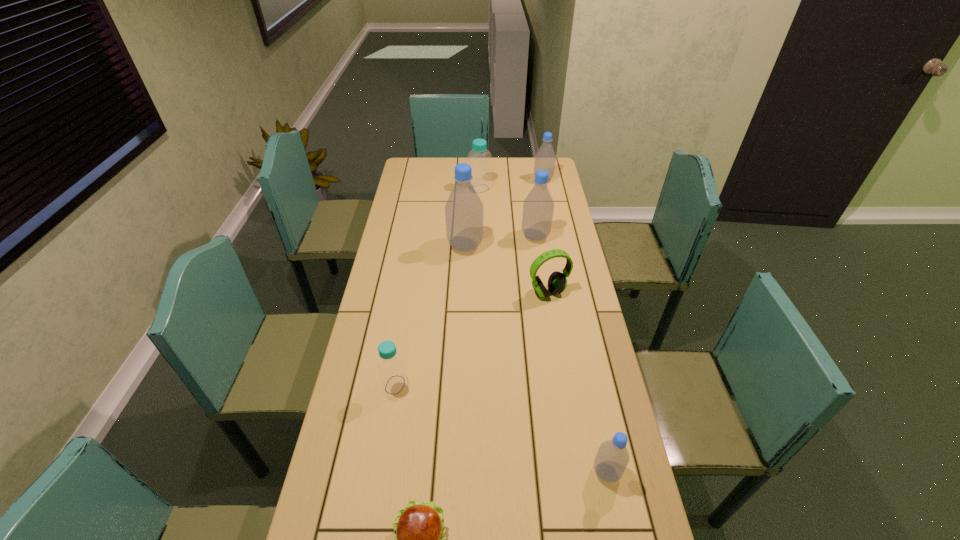
Identify the location of the leftmost gray bottle. (464, 211).

Locate an element on the screen. the tallest object is located at coordinates (464, 211).

Image resolution: width=960 pixels, height=540 pixels. Find the location of `the second tallest object`. the second tallest object is located at coordinates (538, 207).

Identify the location of the third smallest gray bottle. The image size is (960, 540). [x=538, y=207].

Identify the location of the right blue bottle. (479, 158).

Locate an element on the screen. This screenshot has width=960, height=540. the farther blue bottle is located at coordinates (479, 158).

Locate an element on the screen. the third biggest gray bottle is located at coordinates (545, 158).

The width and height of the screenshot is (960, 540). I want to click on green headset, so click(x=557, y=282).

Where is `headset`? Image resolution: width=960 pixels, height=540 pixels. headset is located at coordinates (557, 282).

Find the location of a particular element. the seventh farthest object is located at coordinates (x=612, y=458).